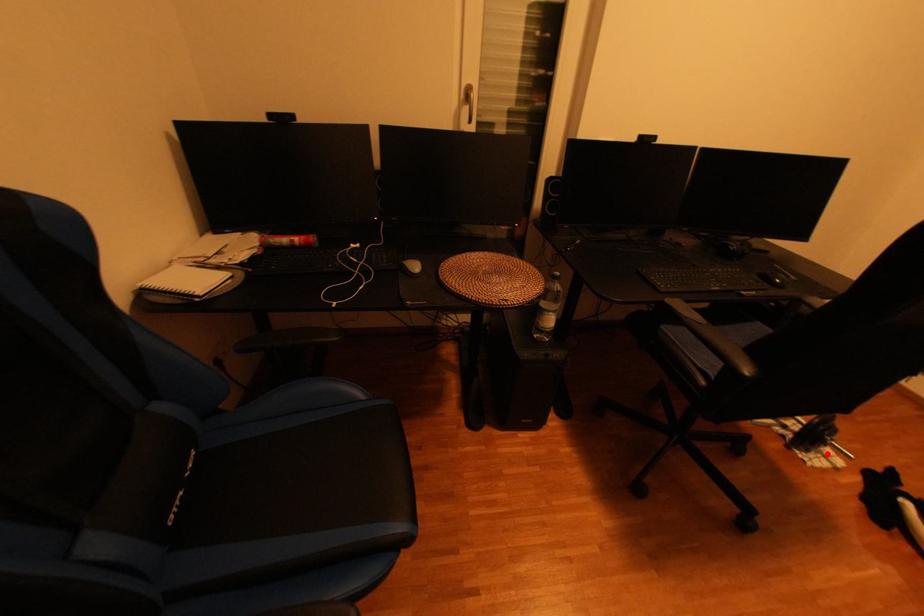
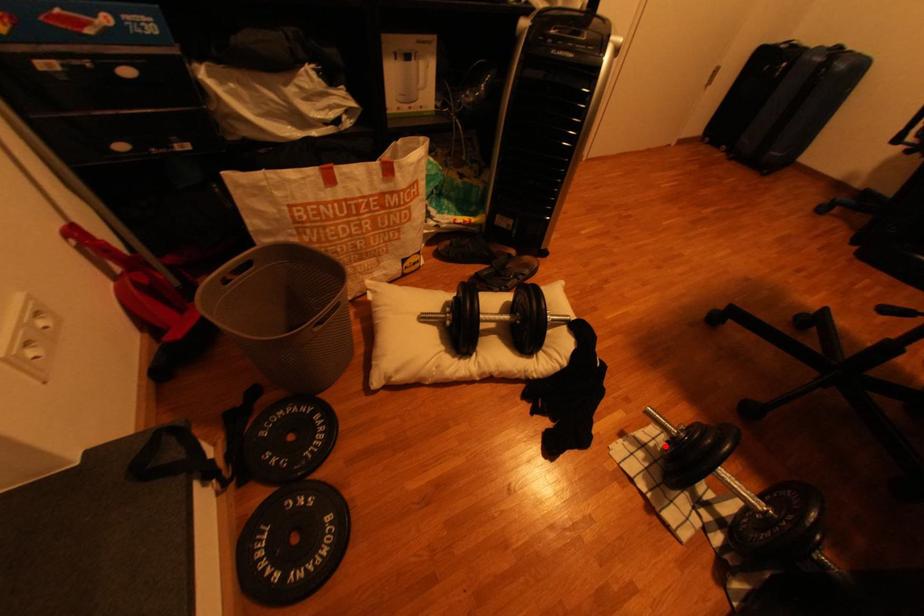
I am providing you with two images of the same scene from different viewpoints. A red point is marked on the first image and another point is marked on the second image. Is the red point in image1 aligned with the point shown in image2?

Yes